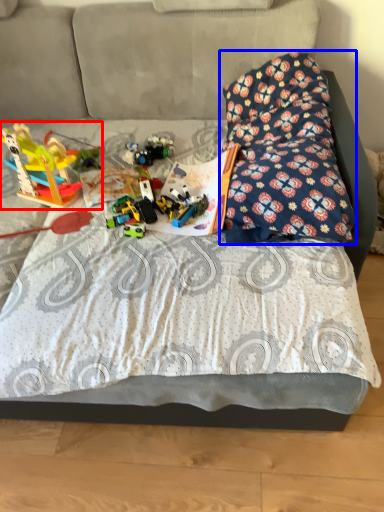
Question: Among these objects, which one is nearest to the camera, toy (highlighted by a red box) or pillow (highlighted by a blue box)?

Choices:
 (A) toy
 (B) pillow

Answer: (B)